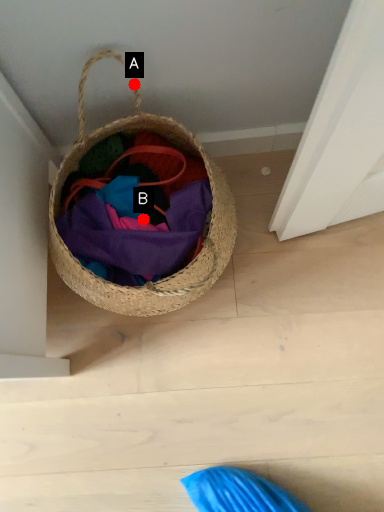
Question: Two points are circled on the image, labeled by A and B beside each circle. Among these points, which one is nearest to the camera?

Choices:
 (A) A is closer
 (B) B is closer

Answer: (A)